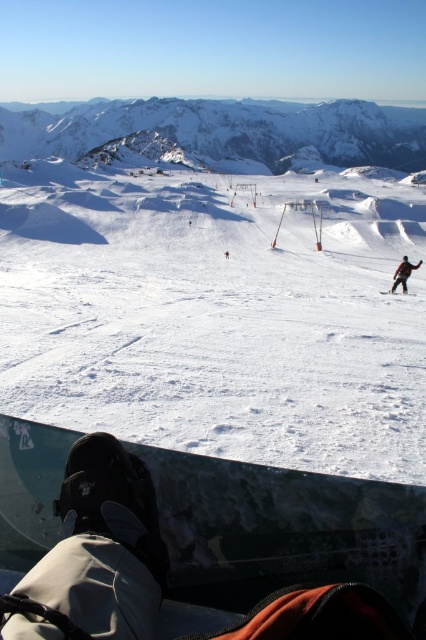
Consider the image. You are a photographer standing at the camera position. You want to take a photo of the shiny black snowboard at lower center. Can you reach it without moving from your current position?

The shiny black snowboard at lower center and camera are 10.40 feet apart from each other. Since the photographer is at the camera position, they can reach the snowboard by extending their arm or using a long lens, but physically moving to touch it would require moving from the current position.

You are planning to build a snowman using the white powdery snow at center and the shiny black snowboard at lower center. Which object would be more suitable for building the snowman?

The white powdery snow at center is more suitable for building a snowman because it has a larger size compared to the shiny black snowboard at lower center.

What is the color and texture of the snow at the point marked by coordinates (216,317)?

The snow at the point marked by coordinates (216,317) is white and powdery in texture.